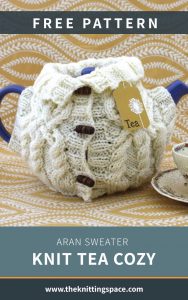
Locate an element on the screen. handle is located at coordinates (8, 95).